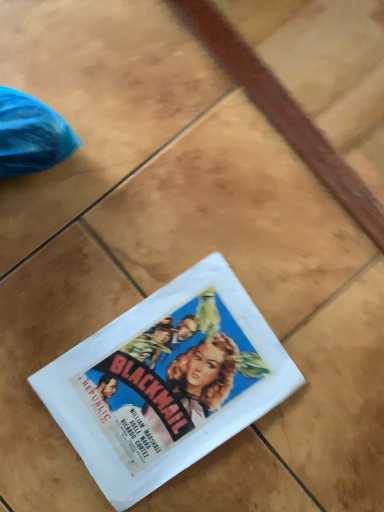
In order to click on white paper flyer at center in this screenshot , I will do `click(167, 382)`.

The height and width of the screenshot is (512, 384). What do you see at coordinates (167, 382) in the screenshot? I see `white paper flyer at center` at bounding box center [167, 382].

Find the location of a particular element. white paper flyer at center is located at coordinates (167, 382).